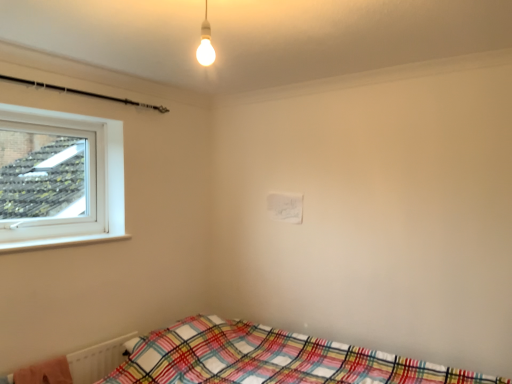
Question: Considering the relative sizes of plaid fabric bed at lower right and plaid fabric blanket at lower left in the image provided, is plaid fabric bed at lower right wider than plaid fabric blanket at lower left?

Choices:
 (A) no
 (B) yes

Answer: (B)

Question: From the image's perspective, is plaid fabric bed at lower right on plaid fabric blanket at lower left?

Choices:
 (A) no
 (B) yes

Answer: (A)

Question: Is plaid fabric bed at lower right oriented away from plaid fabric blanket at lower left?

Choices:
 (A) no
 (B) yes

Answer: (A)

Question: Does plaid fabric bed at lower right have a lesser height compared to plaid fabric blanket at lower left?

Choices:
 (A) no
 (B) yes

Answer: (A)

Question: Does plaid fabric bed at lower right have a smaller size compared to plaid fabric blanket at lower left?

Choices:
 (A) yes
 (B) no

Answer: (B)

Question: Is plaid fabric bed at lower right touching plaid fabric blanket at lower left?

Choices:
 (A) yes
 (B) no

Answer: (B)

Question: Is plaid fabric blanket at lower left positioned beyond the bounds of matte white bulb at upper center?

Choices:
 (A) yes
 (B) no

Answer: (A)

Question: Can you confirm if plaid fabric blanket at lower left is thinner than matte white bulb at upper center?

Choices:
 (A) yes
 (B) no

Answer: (B)

Question: Does plaid fabric blanket at lower left appear on the right side of matte white bulb at upper center?

Choices:
 (A) no
 (B) yes

Answer: (A)

Question: Is plaid fabric blanket at lower left to the left of matte white bulb at upper center from the viewer's perspective?

Choices:
 (A) no
 (B) yes

Answer: (B)

Question: Is plaid fabric blanket at lower left positioned in front of matte white bulb at upper center?

Choices:
 (A) yes
 (B) no

Answer: (B)

Question: Are plaid fabric blanket at lower left and matte white bulb at upper center beside each other?

Choices:
 (A) no
 (B) yes

Answer: (A)

Question: Does plaid fabric bed at lower right have a greater height compared to matte white bulb at upper center?

Choices:
 (A) yes
 (B) no

Answer: (A)